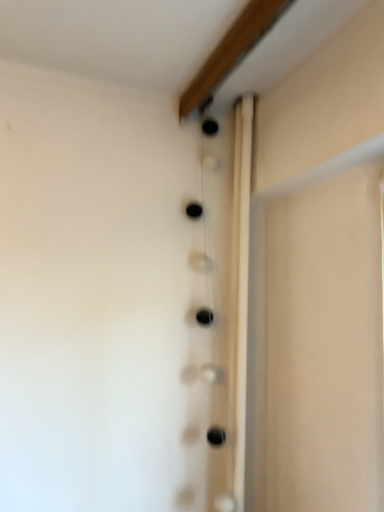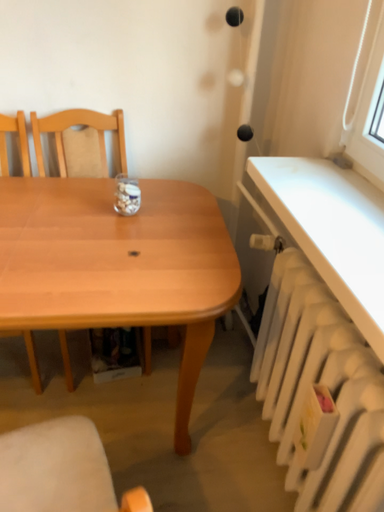
Question: Which way did the camera rotate in the video?

Choices:
 (A) rotated left
 (B) rotated right

Answer: (A)